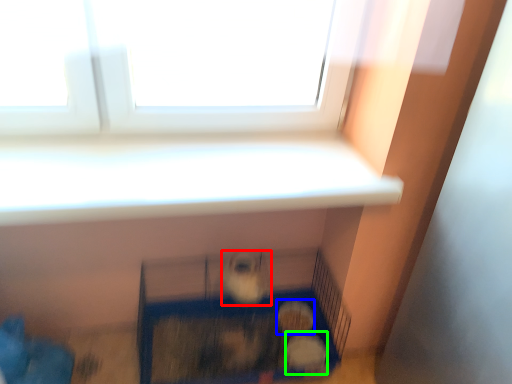
Question: Estimate the real-world distances between objects in this image. Which object is closer to animal (highlighted by a red box), animal (highlighted by a blue box) or animal (highlighted by a green box)?

Choices:
 (A) animal
 (B) animal

Answer: (A)